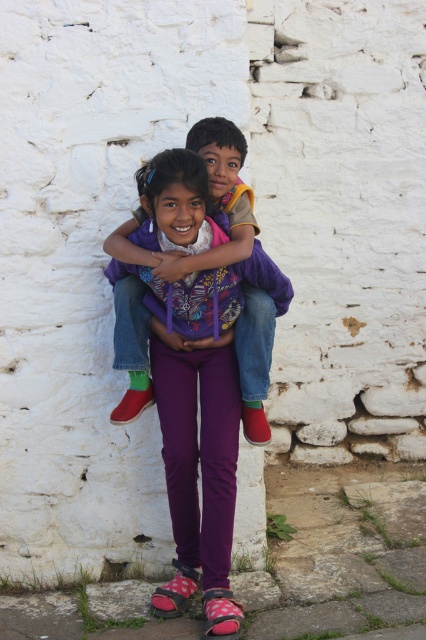
Does purple fleece jacket at center appear over purple fabric at center?

Actually, purple fleece jacket at center is below purple fabric at center.

Between purple fleece jacket at center and purple fabric at center, which one has more height?

purple fleece jacket at center

The width and height of the screenshot is (426, 640). What do you see at coordinates (219, 195) in the screenshot? I see `purple fleece jacket at center` at bounding box center [219, 195].

Find the location of `purple fleece jacket at center`. purple fleece jacket at center is located at coordinates (219, 195).